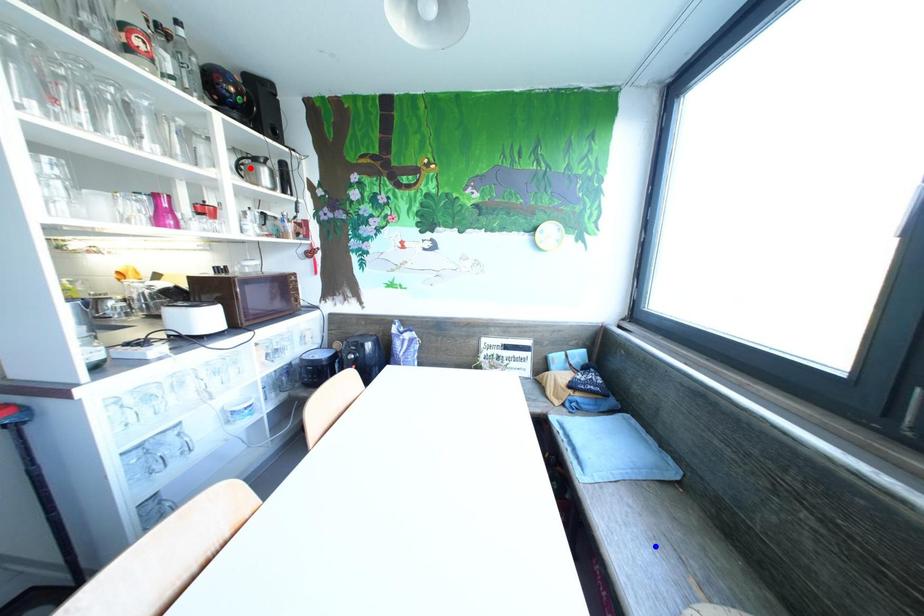
Question: Which of the two points in the image is closer to the camera?

Choices:
 (A) Blue point is closer.
 (B) Red point is closer.

Answer: (A)